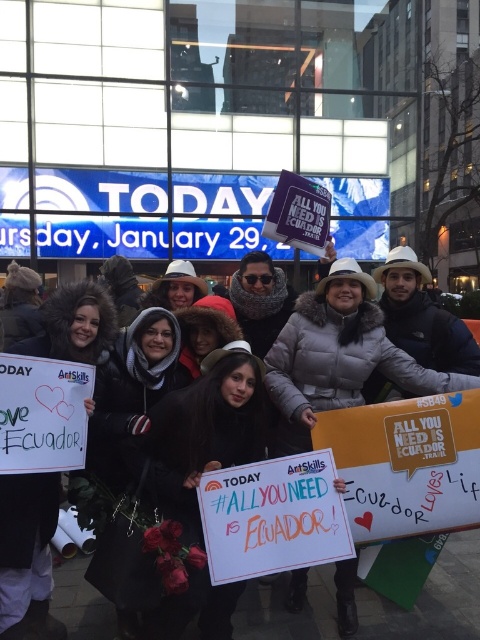
Question: Where is white fur coat at center located in relation to white paper sign at center in the image?

Choices:
 (A) right
 (B) left

Answer: (A)

Question: Is white fur coat at center to the left of white paper sign at center from the viewer's perspective?

Choices:
 (A) yes
 (B) no

Answer: (B)

Question: Can you confirm if white fur coat at center is wider than white paper sign at center?

Choices:
 (A) yes
 (B) no

Answer: (A)

Question: Which point is closer to the camera?

Choices:
 (A) (251, 483)
 (B) (374, 596)

Answer: (A)